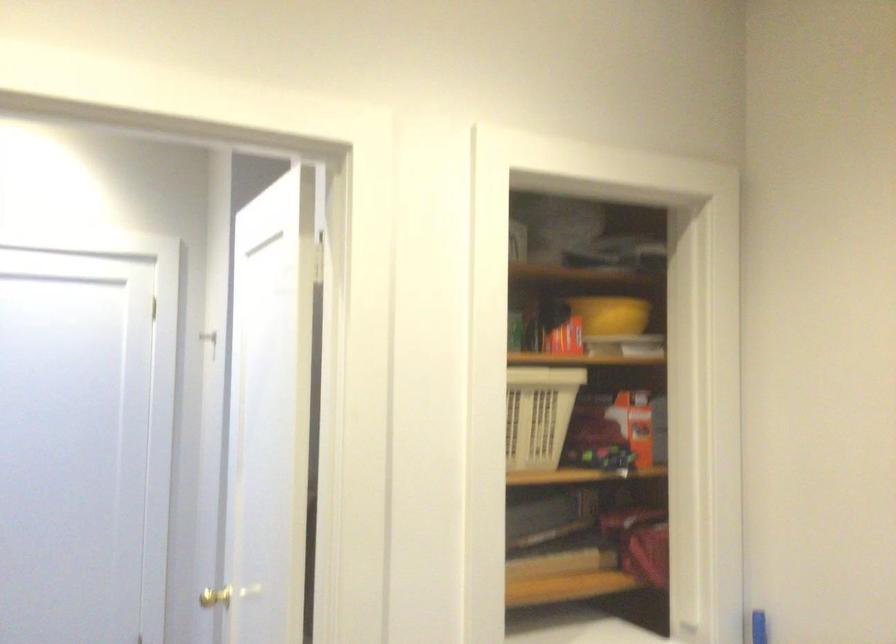
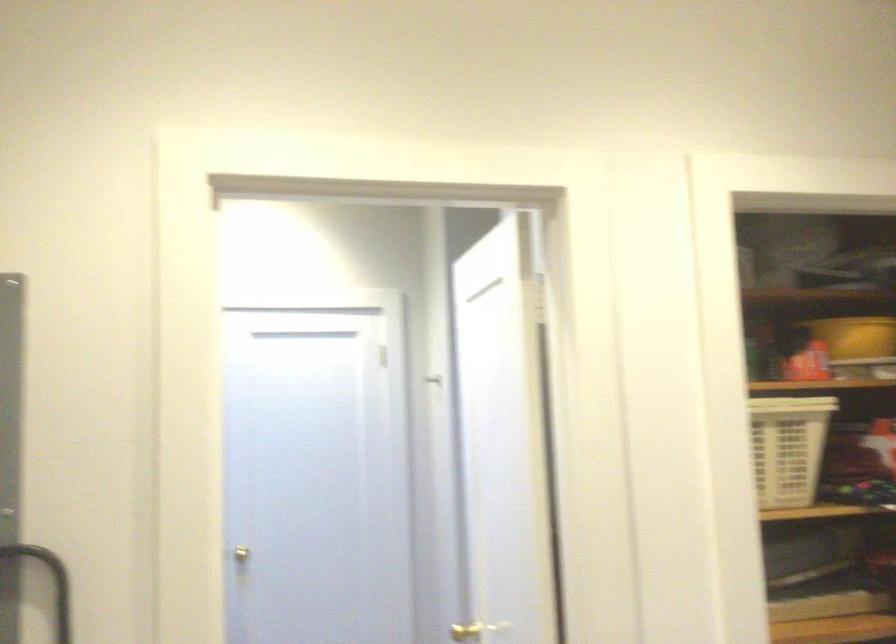
Question: What movement of the cameraman would produce the second image?

Choices:
 (A) Left
 (B) Right
 (C) Forward
 (D) Backward

Answer: (D)